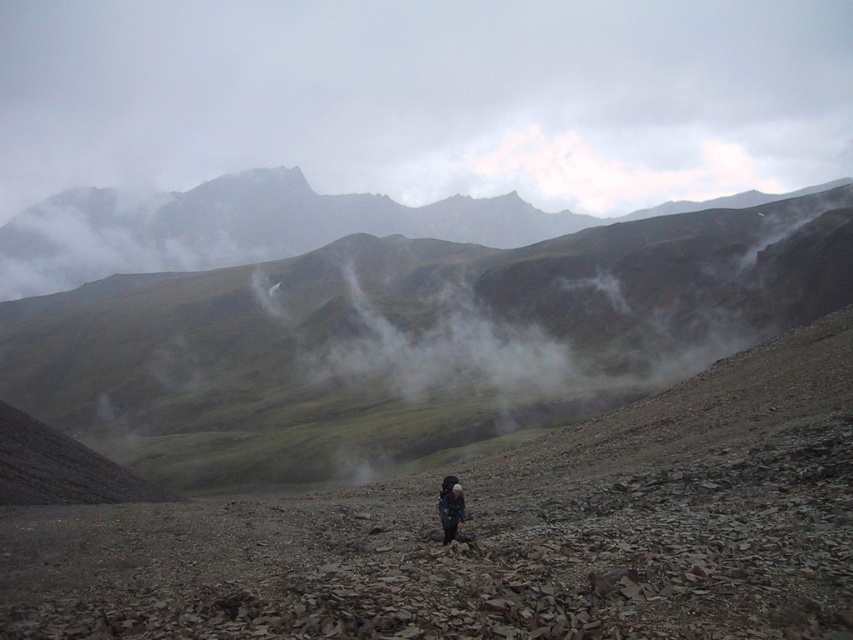
Is point (234, 474) farther from camera compared to point (454, 534)?

Yes, point (234, 474) is behind point (454, 534).

Between rugged brown mountain at center and dark blue fabric backpack at center, which one is positioned higher?

rugged brown mountain at center

Locate an element on the screen. The width and height of the screenshot is (853, 640). rugged brown mountain at center is located at coordinates (409, 339).